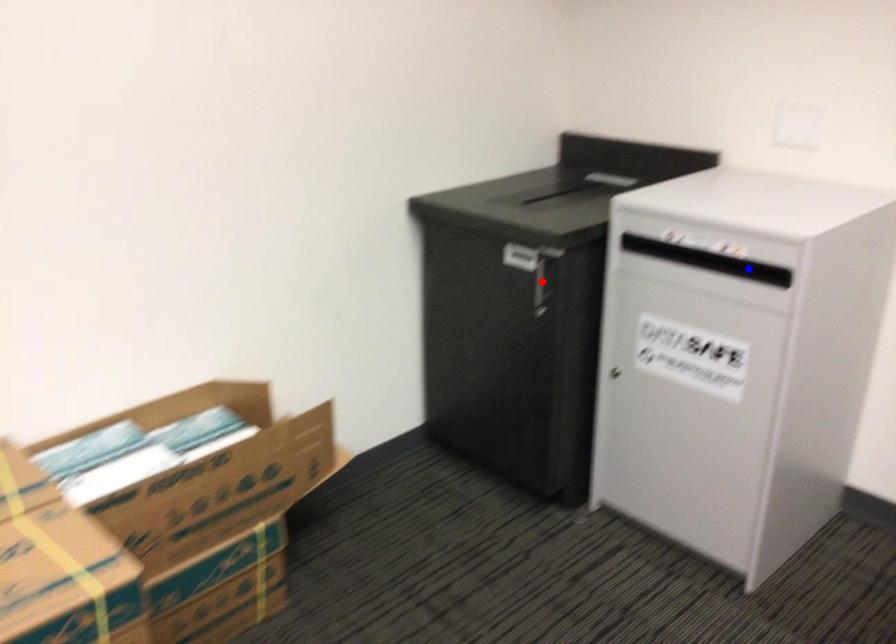
Question: In the image, two points are highlighted. Which point is nearer to the camera? Reply with the corresponding letter.

Choices:
 (A) blue point
 (B) red point

Answer: (A)